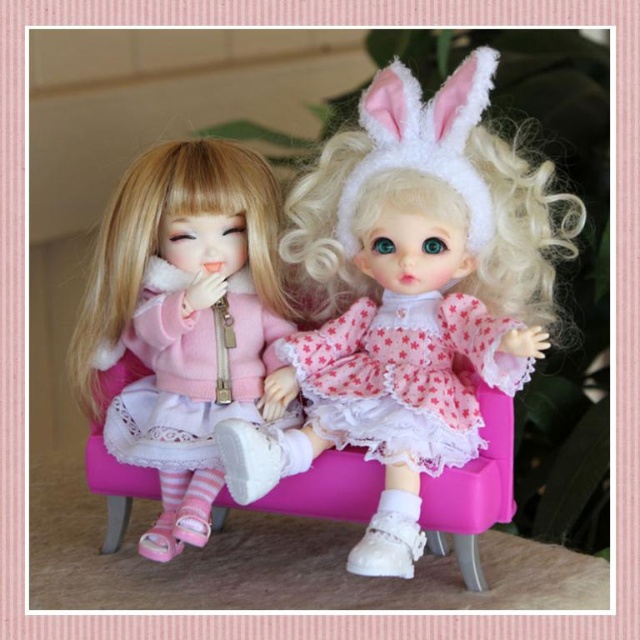
You are organizing a dollhouse and need to determine the vertical arrangement of the matte pink sweater at left and the matte pink fabric dress at left. Based on the scene, which one is positioned higher?

The matte pink sweater at left is positioned higher than the matte pink fabric dress at left because it is described as being above it.